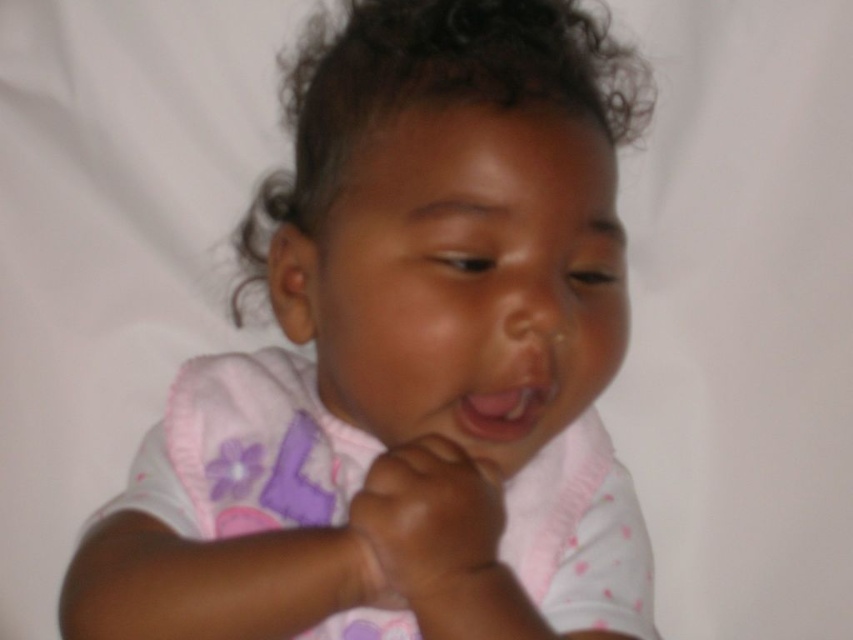
Question: Is pink fabric toddler at center positioned before pink matte lips at center?

Choices:
 (A) no
 (B) yes

Answer: (B)

Question: Estimate the real-world distances between objects in this image. Which object is farther from the pink fabric toddler at center?

Choices:
 (A) smooth skin hand at center
 (B) pink matte lips at center

Answer: (B)

Question: Is pink fabric toddler at center above pink matte lips at center?

Choices:
 (A) no
 (B) yes

Answer: (B)

Question: Which of the following is the closest to the observer?

Choices:
 (A) (471, 432)
 (B) (418, 592)
 (C) (399, 317)

Answer: (B)

Question: Can you confirm if pink fabric toddler at center is positioned above pink matte lips at center?

Choices:
 (A) yes
 (B) no

Answer: (A)

Question: Which object is positioned closest to the smooth skin hand at center?

Choices:
 (A) pink matte lips at center
 (B) pink fabric toddler at center

Answer: (A)